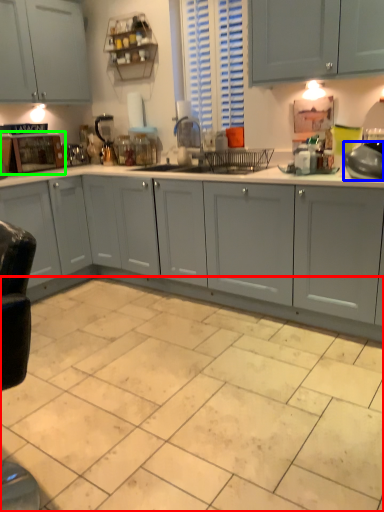
Question: Which object is the farthest from ceramic tile (highlighted by a red box)? Choose among these: appliance (highlighted by a blue box) or home appliance (highlighted by a green box).

Choices:
 (A) appliance
 (B) home appliance

Answer: (B)